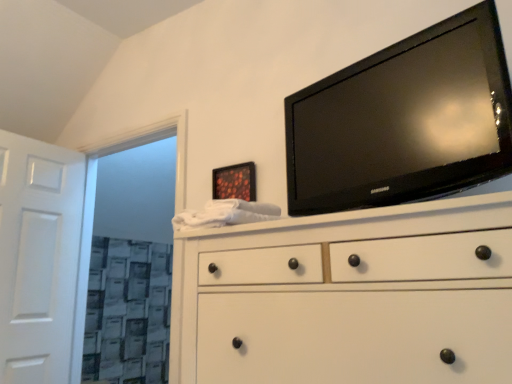
Image resolution: width=512 pixels, height=384 pixels. Describe the element at coordinates (126, 149) in the screenshot. I see `white textured glass door at left` at that location.

What do you see at coordinates (38, 257) in the screenshot?
I see `white wooden door at left` at bounding box center [38, 257].

Find the location of `white textured glass door at left`. white textured glass door at left is located at coordinates (126, 149).

Would you say white textured glass door at left contains black glossy tv at upper right?

That's incorrect, black glossy tv at upper right is not inside white textured glass door at left.

Between point (180, 188) and point (373, 204), which one is positioned in front?

The point (373, 204) is in front.

Visually, is white textured glass door at left positioned to the left or to the right of black glossy tv at upper right?

white textured glass door at left is positioned on black glossy tv at upper right's left side.

How much distance is there between white textured glass door at left and black glossy tv at upper right?

A: A distance of 33.71 inches exists between white textured glass door at left and black glossy tv at upper right.

Does white textured glass door at left appear on the right side of white matte chest of drawers at center?

No, white textured glass door at left is not to the right of white matte chest of drawers at center.

Is white textured glass door at left facing away from white matte chest of drawers at center?

No, white textured glass door at left's orientation is not away from white matte chest of drawers at center.

From a real-world perspective, is white textured glass door at left on top of white matte chest of drawers at center?

Indeed, from a real-world perspective, white textured glass door at left stands above white matte chest of drawers at center.

From the picture: Would you say white textured glass door at left contains white matte chest of drawers at center?

No.

Which of these two, white wooden door at left or white matte chest of drawers at center, is thinner?

With smaller width is white wooden door at left.

From the image's perspective, would you say white wooden door at left is shown under white matte chest of drawers at center?

Correct, white wooden door at left appears lower than white matte chest of drawers at center in the image.

How different are the orientations of white wooden door at left and white matte chest of drawers at center in degrees?

There is a 89.2-degree angle between the facing directions of white wooden door at left and white matte chest of drawers at center.

Is white wooden door at left surrounding white matte chest of drawers at center?

Actually, white matte chest of drawers at center is outside white wooden door at left.

In the scene shown: Who is smaller, white wooden door at left or white textured glass door at left?

white wooden door at left.

From a real-world perspective, is white wooden door at left beneath white textured glass door at left?

Yes, from a real-world perspective, white wooden door at left is under white textured glass door at left.

From the image's perspective, which is above, white wooden door at left or white textured glass door at left?

white textured glass door at left, from the image's perspective.

From a real-world perspective, is black glossy tv at upper right under white wooden door at left?

Actually, black glossy tv at upper right is physically above white wooden door at left in the real world.

Can you tell me how much black glossy tv at upper right and white wooden door at left differ in facing direction?

The angle between the facing direction of black glossy tv at upper right and the facing direction of white wooden door at left is 99.5 degrees.

Considering the relative sizes of black glossy tv at upper right and white wooden door at left in the image provided, is black glossy tv at upper right bigger than white wooden door at left?

No.

Is white textured glass door at left next to white wooden door at left and touching it?

No, white textured glass door at left is not in contact with white wooden door at left.

Is white textured glass door at left located outside white wooden door at left?

Yes, white textured glass door at left is located beyond the bounds of white wooden door at left.

Is white textured glass door at left to the left of white wooden door at left from the viewer's perspective?

No.

Does point (401, 310) come in front of point (57, 220)?

Yes, point (401, 310) is in front of point (57, 220).

From the image's perspective, is white matte chest of drawers at center under white wooden door at left?

No, from the image's perspective, white matte chest of drawers at center is not beneath white wooden door at left.

From a real-world perspective, between white matte chest of drawers at center and white wooden door at left, who is vertically higher?

white wooden door at left.

Would you say white matte chest of drawers at center is a long distance from white wooden door at left?

white matte chest of drawers at center is far away from white wooden door at left.

I want to click on glass door below the black glossy tv at upper right (from a real-world perspective), so click(x=126, y=149).

At what (x,y) coordinates should I click in order to perform the action: click on glass door behind the white matte chest of drawers at center. Please return your answer as a coordinate pair (x, y). Image resolution: width=512 pixels, height=384 pixels. Looking at the image, I should click on (126, 149).

Considering their positions, is white textured glass door at left positioned further to white wooden door at left than white matte chest of drawers at center?

white matte chest of drawers at center is positioned further to the anchor white wooden door at left.

Estimate the real-world distances between objects in this image. Which object is closer to white textured glass door at left, white wooden door at left or white matte chest of drawers at center?

white wooden door at left is positioned closer to the anchor white textured glass door at left.

Looking at the image, which one is located further to white matte chest of drawers at center, black glossy tv at upper right or white wooden door at left?

Based on the image, white wooden door at left appears to be further to white matte chest of drawers at center.

Looking at the image, which one is located further to white matte chest of drawers at center, white textured glass door at left or white wooden door at left?

The object further to white matte chest of drawers at center is white wooden door at left.

From the picture: Which object lies further to the anchor point black glossy tv at upper right, white textured glass door at left or white wooden door at left?

white wooden door at left lies further to black glossy tv at upper right than the other object.

Based on the photo, from the image, which object appears to be nearer to white textured glass door at left, black glossy tv at upper right or white matte chest of drawers at center?

black glossy tv at upper right is positioned closer to the anchor white textured glass door at left.

Which object lies further to the anchor point black glossy tv at upper right, white matte chest of drawers at center or white textured glass door at left?

white textured glass door at left is further to black glossy tv at upper right.

From the image, which object appears to be nearer to white textured glass door at left, white matte chest of drawers at center or black glossy tv at upper right?

black glossy tv at upper right lies closer to white textured glass door at left than the other object.

This screenshot has width=512, height=384. Find the location of `the chest of drawers situated between white wooden door at left and black glossy tv at upper right from left to right`. the chest of drawers situated between white wooden door at left and black glossy tv at upper right from left to right is located at coordinates (353, 296).

Where is `glass door between white wooden door at left and black glossy tv at upper right from left to right`? This screenshot has height=384, width=512. glass door between white wooden door at left and black glossy tv at upper right from left to right is located at coordinates (126, 149).

Image resolution: width=512 pixels, height=384 pixels. What are the coordinates of `the chest of drawers located between white textured glass door at left and black glossy tv at upper right in the left-right direction` in the screenshot? It's located at (353, 296).

Locate an element on the screen. This screenshot has width=512, height=384. glass door between white wooden door at left and white matte chest of drawers at center in the horizontal direction is located at coordinates (126, 149).